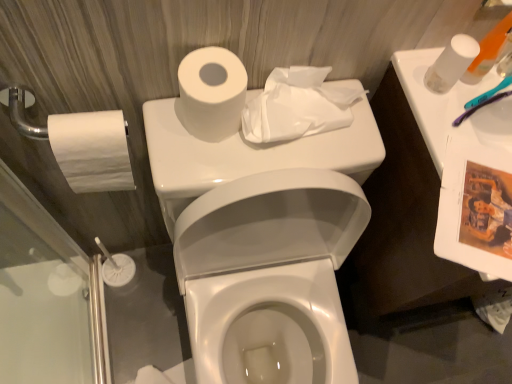
Identify the location of free point in front of white matte toilet paper at upper right, the 4th toilet paper in the left-to-right sequence. The width and height of the screenshot is (512, 384). (460, 155).